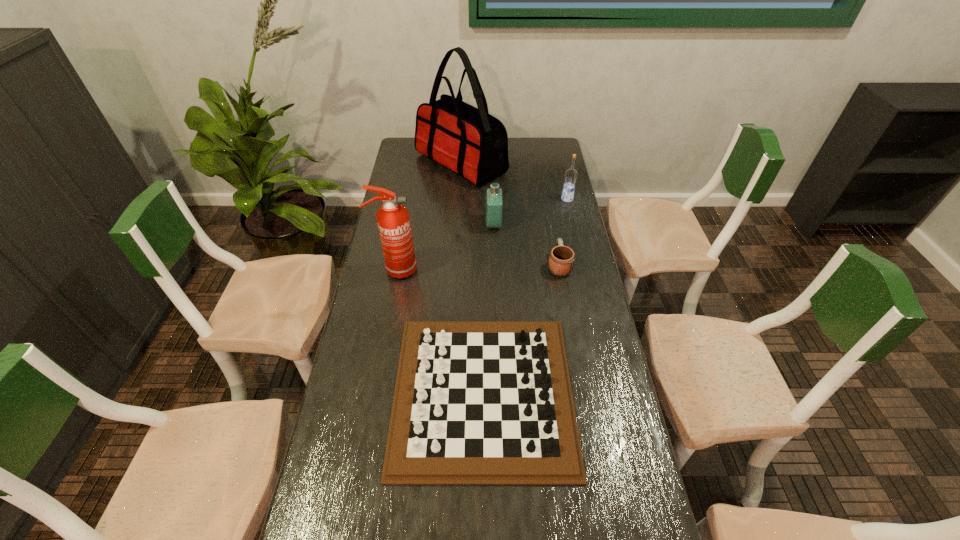
The width and height of the screenshot is (960, 540). What are the coordinates of `free space between the perfume and the fifth shortest object` in the screenshot? It's located at (444, 247).

Identify the location of unoccupied position between the fire extinguisher and the mug. This screenshot has width=960, height=540. (477, 267).

The width and height of the screenshot is (960, 540). Find the location of `vacant area that lies between the fire extinguisher and the mug`. vacant area that lies between the fire extinguisher and the mug is located at coordinates (477, 267).

What are the coordinates of `vacant space that's between the perfume and the second tallest object` in the screenshot? It's located at (444, 247).

Where is `unoccupied area between the tallest object and the mug`? unoccupied area between the tallest object and the mug is located at coordinates (510, 214).

Locate an element on the screen. object that is the fifth closest one to the gameboard is located at coordinates (469, 141).

Identify the location of object identified as the third closest to the nearest object. (494, 194).

Where is `free space that satisfies the following two spatial constraints: 1. on the side of the fifth nearest object with the handle; 2. on the left side of the mug`? The height and width of the screenshot is (540, 960). free space that satisfies the following two spatial constraints: 1. on the side of the fifth nearest object with the handle; 2. on the left side of the mug is located at coordinates (547, 199).

The height and width of the screenshot is (540, 960). In order to click on free location that satisfies the following two spatial constraints: 1. on the front side of the farthest object; 2. at the nozzle of the fifth shortest object in this screenshot , I will do `click(455, 270)`.